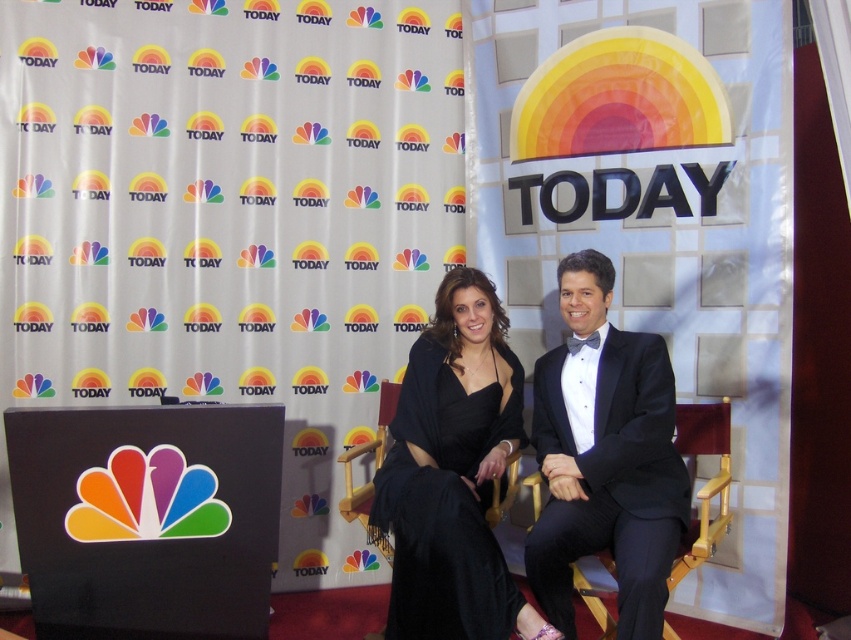
You are standing in front of the NBC TODAY show backdrop and want to place a small decoration at one of the two points marked on the backdrop. The first point is at coordinate point (455, 500) and the second is at point (701, 508). Which point is closer to you?

Point (455, 500) is closer to the camera than point (701, 508), so you should place the decoration at point (455, 500) since it is closer to you.

From the picture: You are a fashion designer observing the scene. You need to determine which item is taller between the black satin dress at center and the wooden chair at center. Which one is taller?

The black satin dress at center is taller than the wooden chair at center.

You are a photographer setting up for a photo shoot in the scene described. You need to ensure that the black pinstripe suit at center and the wooden chair at center are both visible in the frame. Given their sizes, which object should you focus on to ensure both are in the frame without cropping?

The black pinstripe suit at center has a larger size compared to the wooden chair at center. To ensure both are in the frame without cropping, focus on the larger object, the black pinstripe suit at center, as it requires more space.